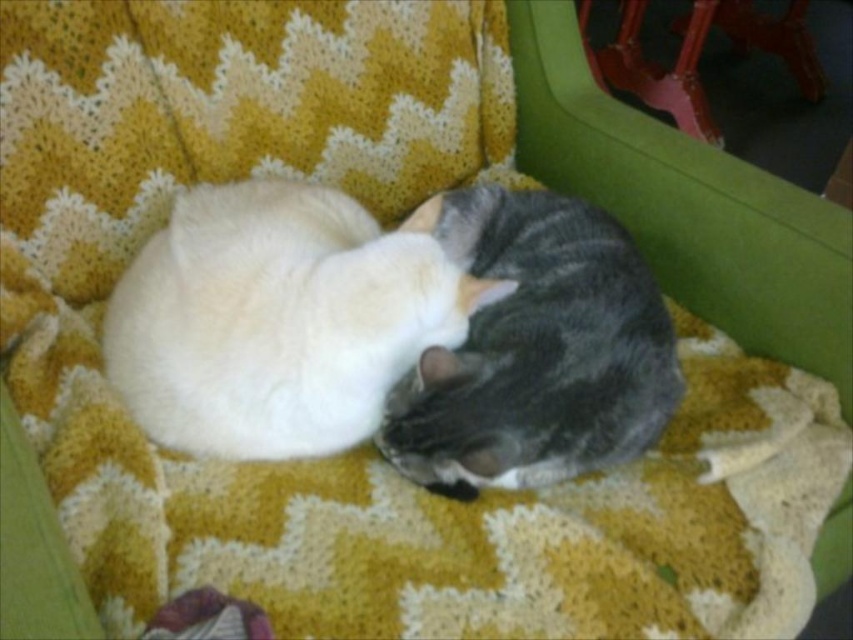
Question: Can you confirm if white soft fur cat at center is thinner than gray striped cat at center?

Choices:
 (A) no
 (B) yes

Answer: (A)

Question: Is white soft fur cat at center further to camera compared to gray striped cat at center?

Choices:
 (A) no
 (B) yes

Answer: (B)

Question: Does white soft fur cat at center come behind gray striped cat at center?

Choices:
 (A) no
 (B) yes

Answer: (B)

Question: Which of the following is the closest to the observer?

Choices:
 (A) gray striped cat at center
 (B) white soft fur cat at center

Answer: (A)